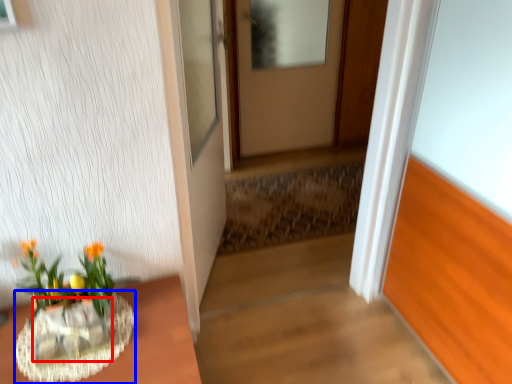
Question: Which of the following is the closest to the observer, glass vase (highlighted by a red box) or vase (highlighted by a blue box)?

Choices:
 (A) glass vase
 (B) vase

Answer: (B)